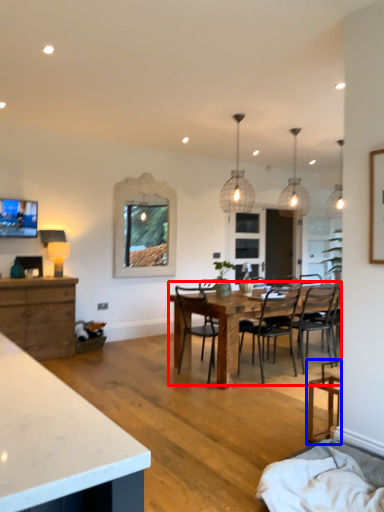
Question: Which object appears farthest to the camera in this image, kitchen & dining room table (highlighted by a red box) or chair (highlighted by a blue box)?

Choices:
 (A) kitchen & dining room table
 (B) chair

Answer: (A)